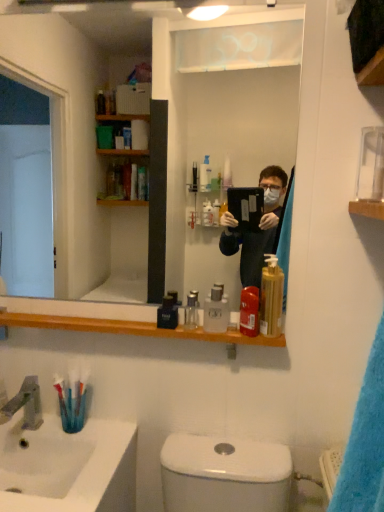
Where is `vacant region to the left of black glossy bottle at center, which ranks as the fourth mouthwash in right-to-left order`? Image resolution: width=384 pixels, height=512 pixels. vacant region to the left of black glossy bottle at center, which ranks as the fourth mouthwash in right-to-left order is located at coordinates (124, 324).